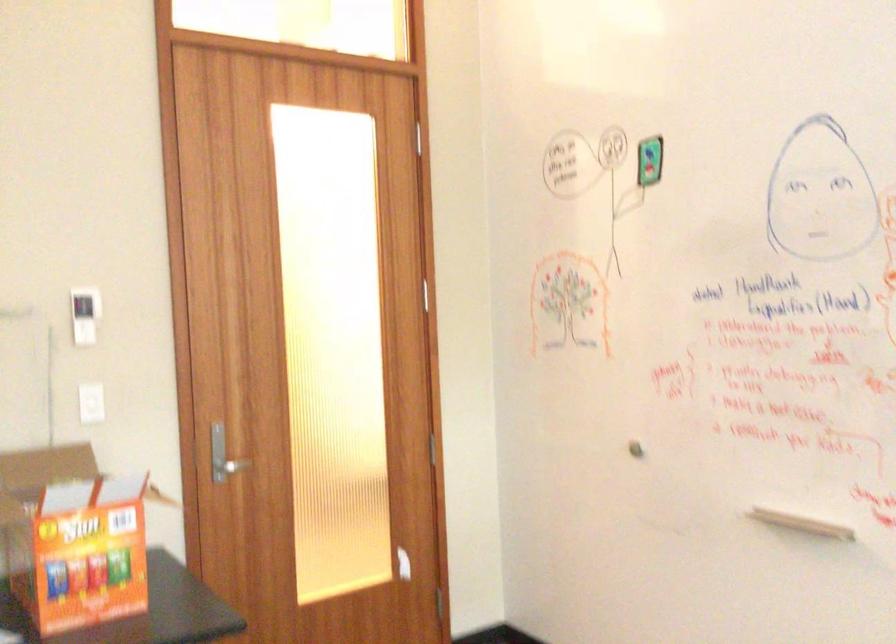
At what (x,y) coordinates should I click in order to perform the action: click on metal door handle. Please return your answer as a coordinate pair (x, y). The image size is (896, 644). Looking at the image, I should click on pyautogui.click(x=226, y=466).